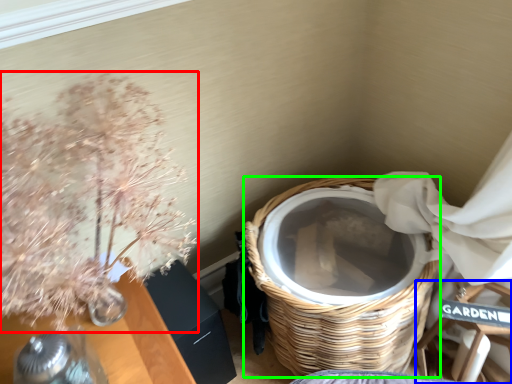
Question: Considering the real-world distances, which object is closest to floral arrangement (highlighted by a red box)? armchair (highlighted by a blue box) or basket (highlighted by a green box).

Choices:
 (A) armchair
 (B) basket

Answer: (B)